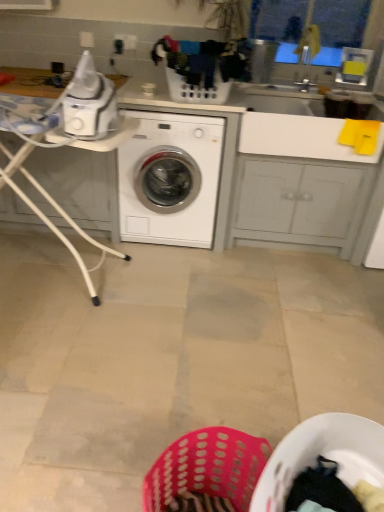
At what (x,y) coordinates should I click in order to perform the action: click on vacant point to the right of white plastic table at left. Please return your answer as a coordinate pair (x, y). The width and height of the screenshot is (384, 512). Looking at the image, I should click on (187, 298).